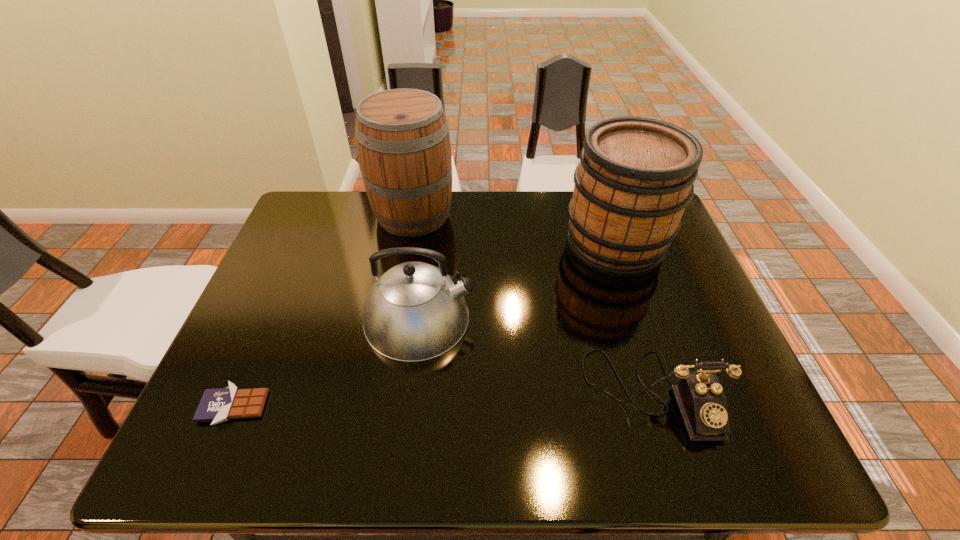
You are a GUI agent. You are given a task and a screenshot of the screen. Output one action in this format:
    pyautogui.click(x=<x>, y=<y>)
    Task: Click on the left cider
    This screenshot has height=540, width=960.
    Given the screenshot: What is the action you would take?
    pyautogui.click(x=402, y=135)

Locate an element on the screen. This screenshot has width=960, height=540. the right cider is located at coordinates (635, 177).

Image resolution: width=960 pixels, height=540 pixels. What are the coordinates of `the third shortest object` in the screenshot? It's located at (415, 311).

Find the location of a particular element. telephone is located at coordinates (702, 403).

The image size is (960, 540). I want to click on the leftmost object, so click(217, 405).

Locate an element on the screen. chocolate bar is located at coordinates (217, 405).

I want to click on vacant space located on the right of the left cider, so click(x=509, y=214).

At what (x,y) coordinates should I click in order to perform the action: click on vacant space located on the left of the right cider. Please return your answer as a coordinate pair (x, y). Looking at the image, I should click on (509, 245).

This screenshot has width=960, height=540. What are the coordinates of `vacant space located 0.050m from the spout of the third shortest object` in the screenshot? It's located at (494, 319).

Where is `blank area located 0.120m on the right of the leftmost object`? blank area located 0.120m on the right of the leftmost object is located at coordinates (324, 407).